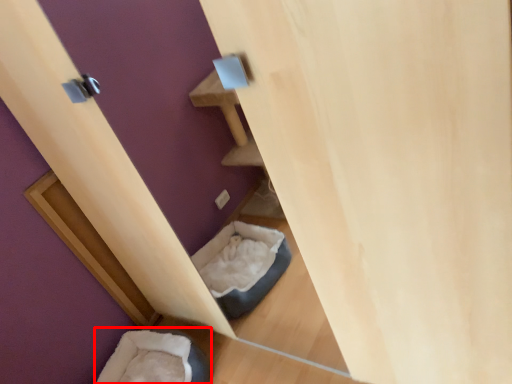
Question: From the image's perspective, what is the correct spatial relationship of bean bag chair (annotated by the red box) in relation to wood?

Choices:
 (A) below
 (B) above

Answer: (A)